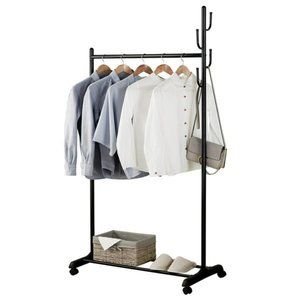
The height and width of the screenshot is (300, 300). In order to click on hangers in this screenshot , I will do `click(142, 68)`, `click(163, 67)`, `click(183, 69)`, `click(122, 67)`, `click(103, 69)`.